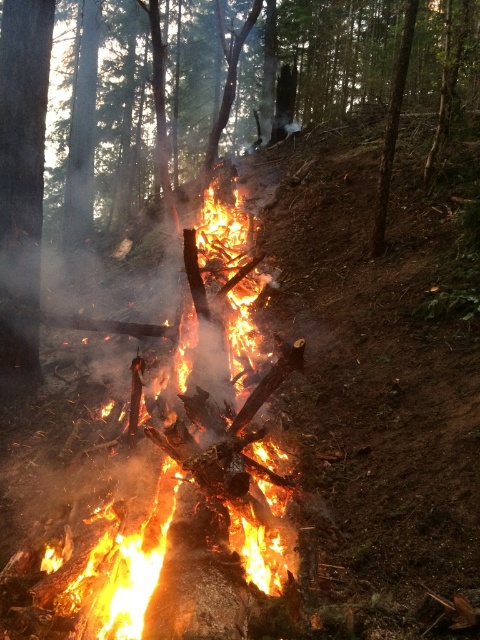
You are standing in the forest and want to move from the smooth bark tree at left to the flaming wood at center. Which direction should you move to reach it?

To move from the smooth bark tree at left to the flaming wood at center, you should move to the right since the flaming wood at center is positioned on the right side of the smooth bark tree at left.

You are standing at the edge of the forest looking at the bonfire. There are two points marked in the image, point A at coordinates point (358, 96) and point B at coordinates point (24, 93). Which point is closer to you?

Point B at coordinates point (24, 93) is closer to you because it is less further to the camera than point A at coordinates point (358, 96).